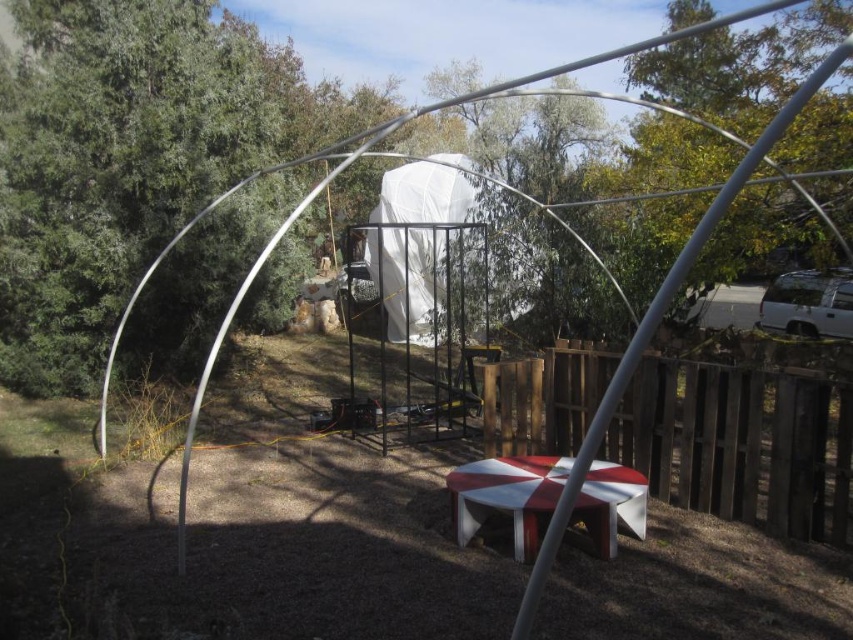
Locate an element on the screen. This screenshot has width=853, height=640. wooden at right is located at coordinates (740, 442).

Is wooden at right bigger than white glossy picnic table at center?

Yes.

Does point (490, 378) come farther from viewer compared to point (590, 484)?

That is True.

Locate an element on the screen. This screenshot has height=640, width=853. wooden at right is located at coordinates (740, 442).

Does wooden at right have a lesser height compared to white fabric tent at center?

Indeed, wooden at right has a lesser height compared to white fabric tent at center.

Is wooden at right to the left of white fabric tent at center from the viewer's perspective?

No, wooden at right is not to the left of white fabric tent at center.

Who is more forward, (483, 433) or (489, 211)?

Point (483, 433) is more forward.

You are a GUI agent. You are given a task and a screenshot of the screen. Output one action in this format:
    pyautogui.click(x=<x>, y=<y>)
    Task: Click on the wooden at right
    
    Given the screenshot: What is the action you would take?
    pyautogui.click(x=740, y=442)

Between white fabric tent at center and white glossy picnic table at center, which one is positioned lower?

white glossy picnic table at center

Does white fabric tent at center come in front of white glossy picnic table at center?

That is False.

Between point (401, 253) and point (610, 548), which one is positioned in front?

Point (610, 548) is in front.

Image resolution: width=853 pixels, height=640 pixels. In order to click on white fabric tent at center in this screenshot , I will do `click(463, 221)`.